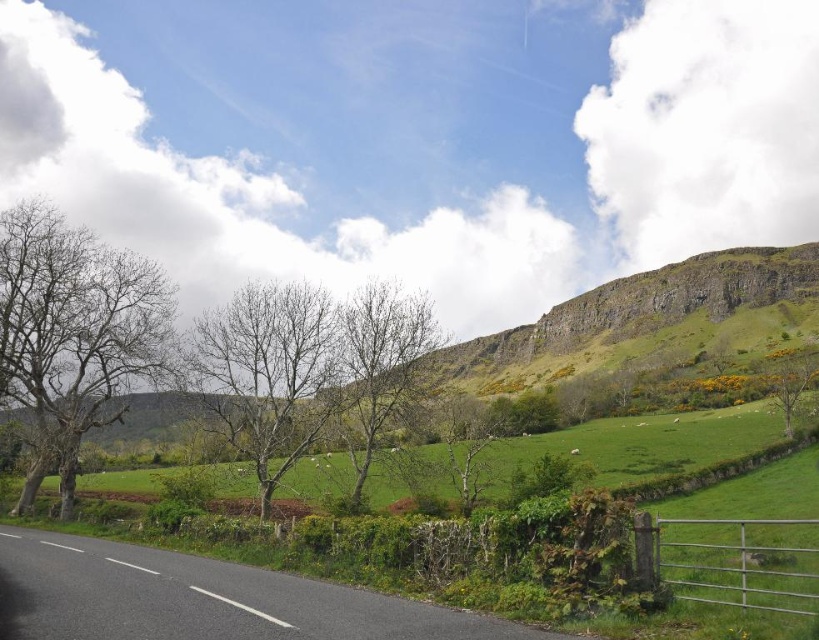
The height and width of the screenshot is (640, 819). Describe the element at coordinates (73, 333) in the screenshot. I see `bare branches at left` at that location.

Does bare branches at left appear on the right side of bare branches at center?

Incorrect, bare branches at left is not on the right side of bare branches at center.

Find the location of a particular element. This screenshot has width=819, height=640. bare branches at left is located at coordinates (73, 333).

Is bare branches at center closer to the viewer compared to bare wood tree at center?

Yes.

Who is more forward, (313, 317) or (451, 456)?

Positioned in front is point (313, 317).

Identify the location of bare branches at center. Image resolution: width=819 pixels, height=640 pixels. (267, 372).

Which is more to the left, bare wood at center or bare wood tree at center?

bare wood at center

Measure the distance between point (374, 442) and camera.

They are 234.28 feet apart.

Where is `bare wood at center`? The width and height of the screenshot is (819, 640). bare wood at center is located at coordinates (378, 365).